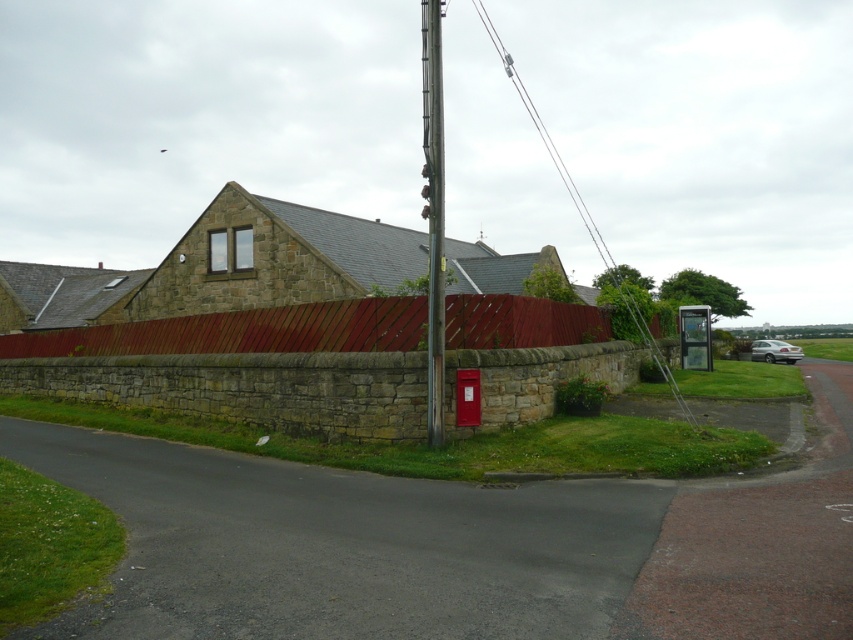
How much distance is there between smooth metallic pole at center and silver metallic car at right?

smooth metallic pole at center is 148.11 feet from silver metallic car at right.

Is smooth metallic pole at center to the left of silver metallic car at right from the viewer's perspective?

Correct, you'll find smooth metallic pole at center to the left of silver metallic car at right.

What do you see at coordinates (433, 211) in the screenshot? I see `smooth metallic pole at center` at bounding box center [433, 211].

Locate an element on the screen. smooth metallic pole at center is located at coordinates (433, 211).